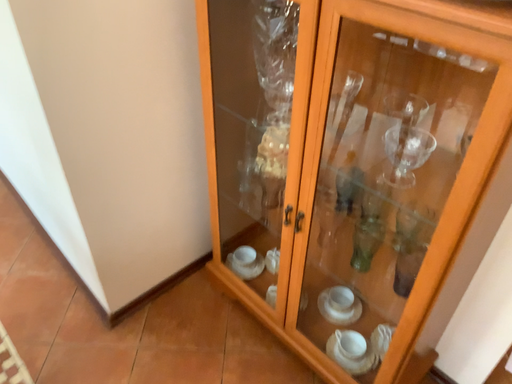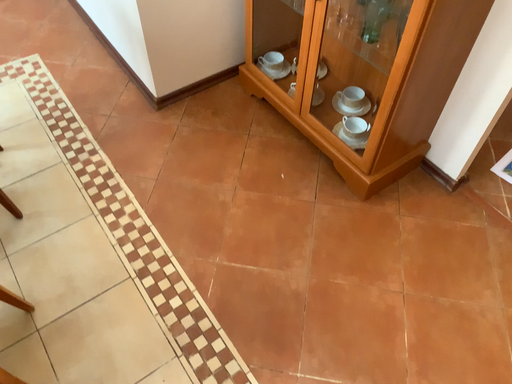
Question: How did the camera likely rotate when shooting the video?

Choices:
 (A) rotated upward
 (B) rotated downward

Answer: (B)